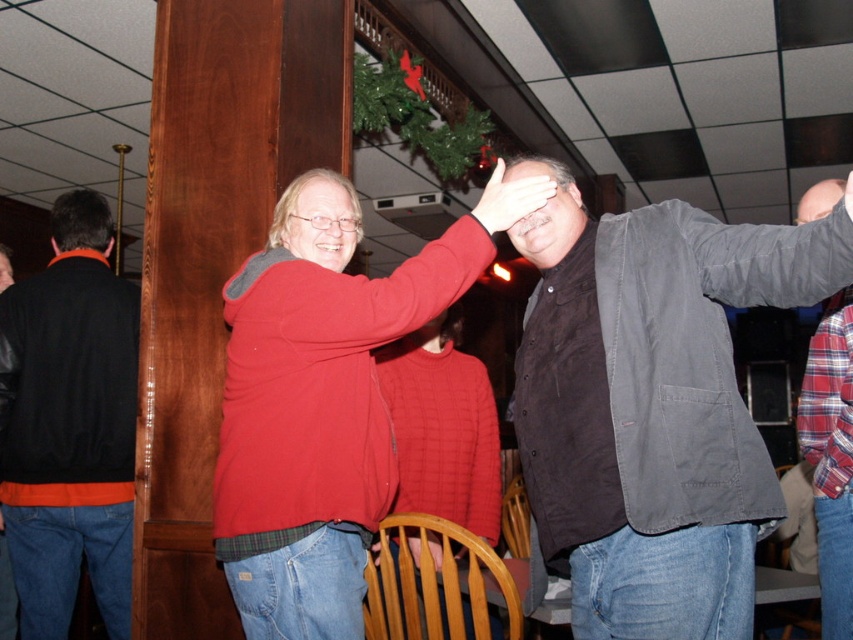
This screenshot has width=853, height=640. What do you see at coordinates (651, 404) in the screenshot? I see `dark gray cotton jacket at center` at bounding box center [651, 404].

Which is in front, point (566, 289) or point (822, 333)?

Point (566, 289) is in front.

Between point (537, 376) and point (815, 464), which one is positioned in front?

Point (537, 376) is more forward.

Where is `dark gray cotton jacket at center`? dark gray cotton jacket at center is located at coordinates (x=651, y=404).

Image resolution: width=853 pixels, height=640 pixels. What do you see at coordinates (316, 406) in the screenshot?
I see `matte red sweater at center` at bounding box center [316, 406].

Does point (241, 566) come farther from viewer compared to point (521, 189)?

No, (241, 566) is in front of (521, 189).

Locate an element on the screen. The image size is (853, 640). matte red sweater at center is located at coordinates (316, 406).

Is plaid flannel shirt at right to the right of matte black sweater at center from the viewer's perspective?

Correct, you'll find plaid flannel shirt at right to the right of matte black sweater at center.

Based on the photo, how far apart are plaid flannel shirt at right and matte black sweater at center?

The distance of plaid flannel shirt at right from matte black sweater at center is 2.30 meters.

Is point (825, 417) positioned before point (4, 627)?

Yes, it is.

You are a GUI agent. You are given a task and a screenshot of the screen. Output one action in this format:
    pyautogui.click(x=<x>, y=<y>)
    Task: Click on the plaid flannel shirt at right
    The image size is (853, 640).
    Given the screenshot: What is the action you would take?
    pyautogui.click(x=830, y=458)